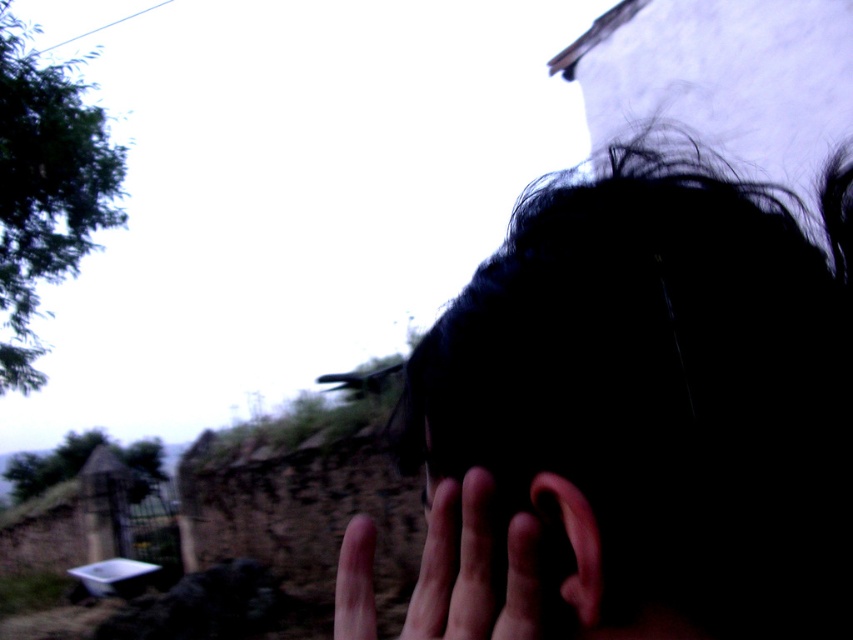
Question: In this image, where is black matte hair at upper right located relative to pink flesh-colored ear at center?

Choices:
 (A) left
 (B) right

Answer: (B)

Question: Does black matte hair at upper right appear under pink flesh-colored ear at center?

Choices:
 (A) yes
 (B) no

Answer: (B)

Question: Does dark skin hand at center appear over pink flesh-colored ear at center?

Choices:
 (A) yes
 (B) no

Answer: (B)

Question: Considering the real-world distances, which object is farthest from the black matte hair at upper right?

Choices:
 (A) pink flesh-colored ear at center
 (B) dark skin hand at center

Answer: (A)

Question: Based on their relative distances, which object is nearer to the dark skin hand at center?

Choices:
 (A) pink flesh-colored ear at center
 (B) black matte hair at upper right

Answer: (A)

Question: Which object is farther from the camera taking this photo?

Choices:
 (A) dark skin hand at center
 (B) black matte hair at upper right

Answer: (A)